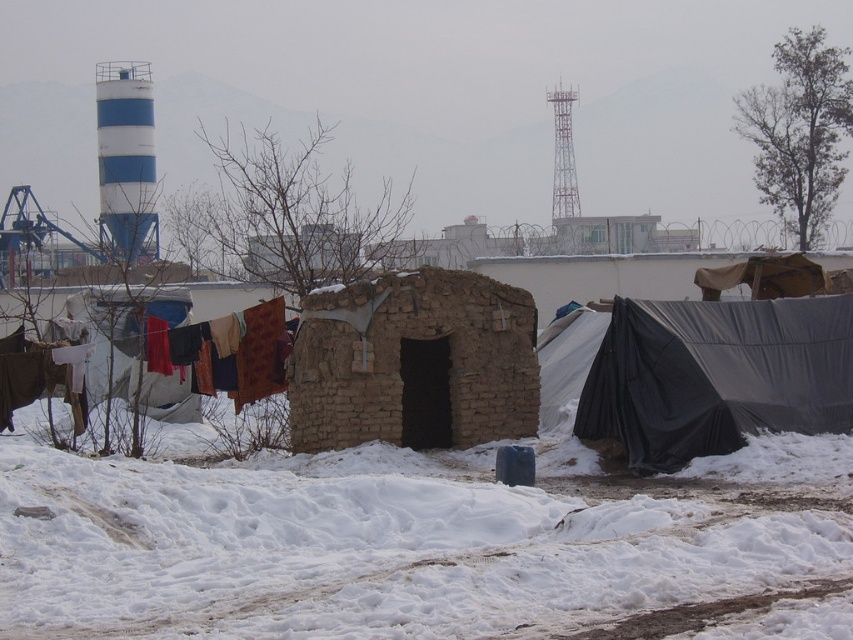
Question: From the image, what is the correct spatial relationship of white fluffy snow at center in relation to multicolored fabric at left?

Choices:
 (A) right
 (B) left

Answer: (A)

Question: Is white fluffy snow at center smaller than brown mud hut at center?

Choices:
 (A) yes
 (B) no

Answer: (B)

Question: Which object is the farthest from the black tarpaulin tent at right?

Choices:
 (A) brown mud hut at center
 (B) white fluffy snow at center

Answer: (B)

Question: Is white fluffy snow at center above multicolored fabric at left?

Choices:
 (A) no
 (B) yes

Answer: (A)

Question: Which point is closer to the camera taking this photo?

Choices:
 (A) (544, 525)
 (B) (659, 353)
 (C) (126, 337)
 (D) (430, 406)

Answer: (A)

Question: Considering the real-world distances, which object is farthest from the white fluffy snow at center?

Choices:
 (A) multicolored fabric at left
 (B) brown mud hut at center

Answer: (A)